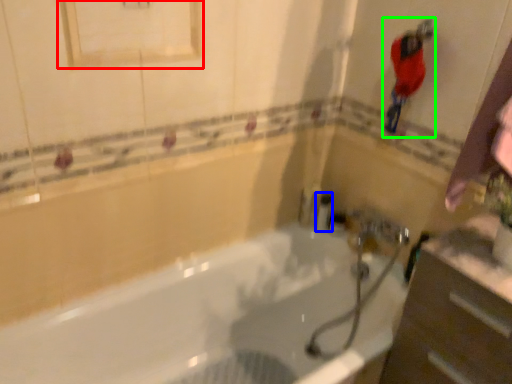
Question: Which is farther away from medicine cabinet (highlighted by a red box)? toiletry (highlighted by a blue box) or person (highlighted by a green box)?

Choices:
 (A) toiletry
 (B) person

Answer: (A)